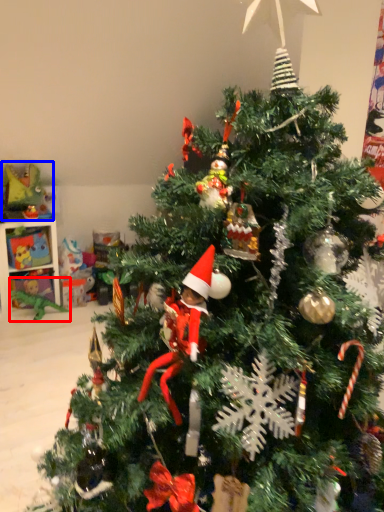
Question: Among these objects, which one is farthest to the camera, toy (highlighted by a red box) or toy (highlighted by a blue box)?

Choices:
 (A) toy
 (B) toy

Answer: (A)